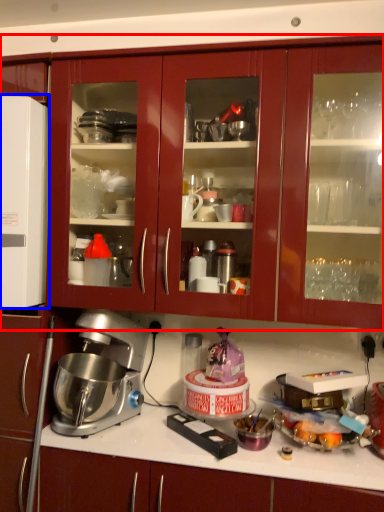
Question: Which object appears farthest to the camera in this image, cabinetry (highlighted by a red box) or appliance (highlighted by a blue box)?

Choices:
 (A) cabinetry
 (B) appliance

Answer: (B)